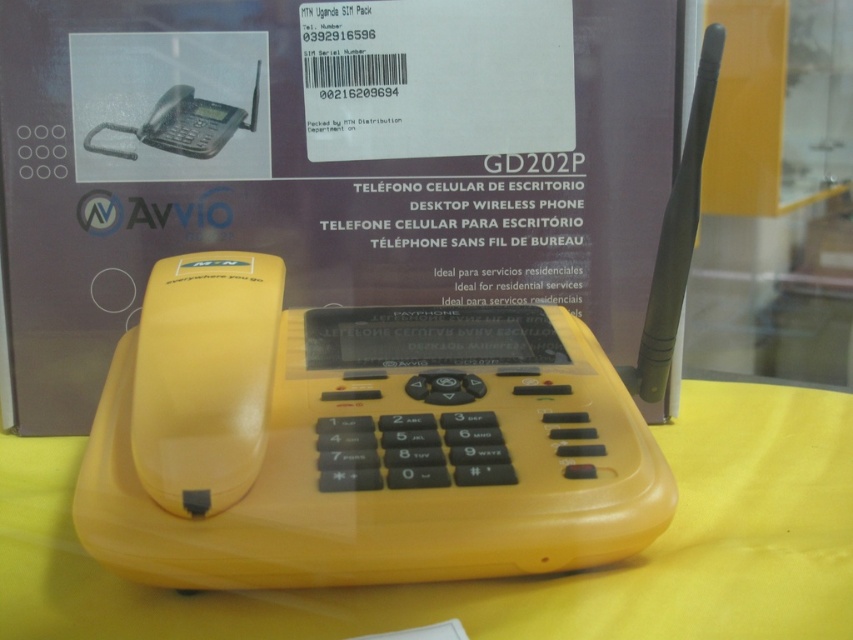
Question: Does yellow plastic phone at center come in front of matte black phone at upper left?

Choices:
 (A) no
 (B) yes

Answer: (B)

Question: Does yellow plastic phone at center appear over matte black phone at upper left?

Choices:
 (A) no
 (B) yes

Answer: (A)

Question: Which of the following is the closest to the observer?

Choices:
 (A) click(795, 481)
 (B) click(258, 74)

Answer: (A)

Question: Can you confirm if yellow plastic phone at center is thinner than matte black phone at upper left?

Choices:
 (A) no
 (B) yes

Answer: (A)

Question: Which of the following is the closest to the observer?

Choices:
 (A) matte black phone at upper left
 (B) yellow plastic phone at center

Answer: (B)